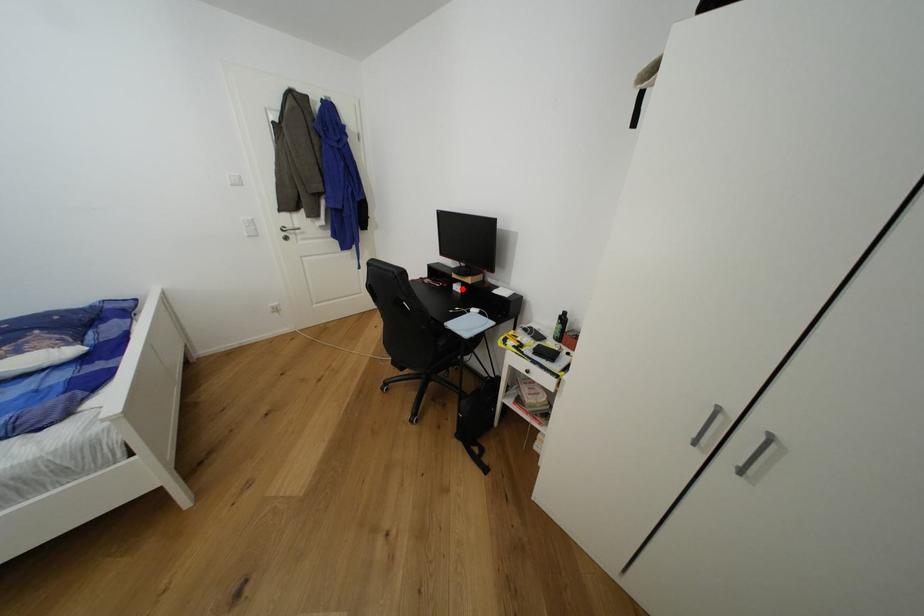
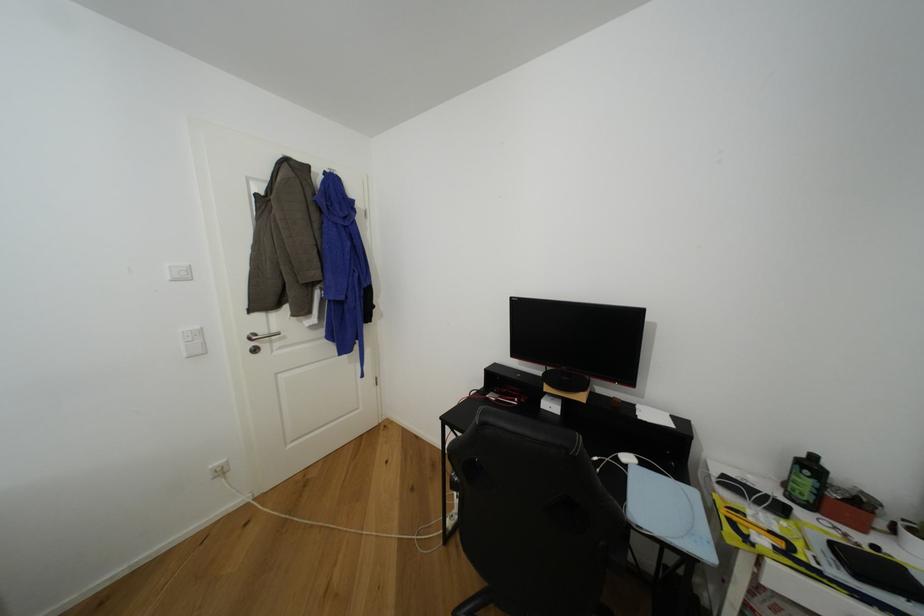
Question: I am providing you with two images of the same scene from different viewpoints. Image1 has a red point marked. In image2, the corresponding 3D location appears at what relative position? Reply with the corresponding letter.

Choices:
 (A) Closer
 (B) Farther

Answer: (B)